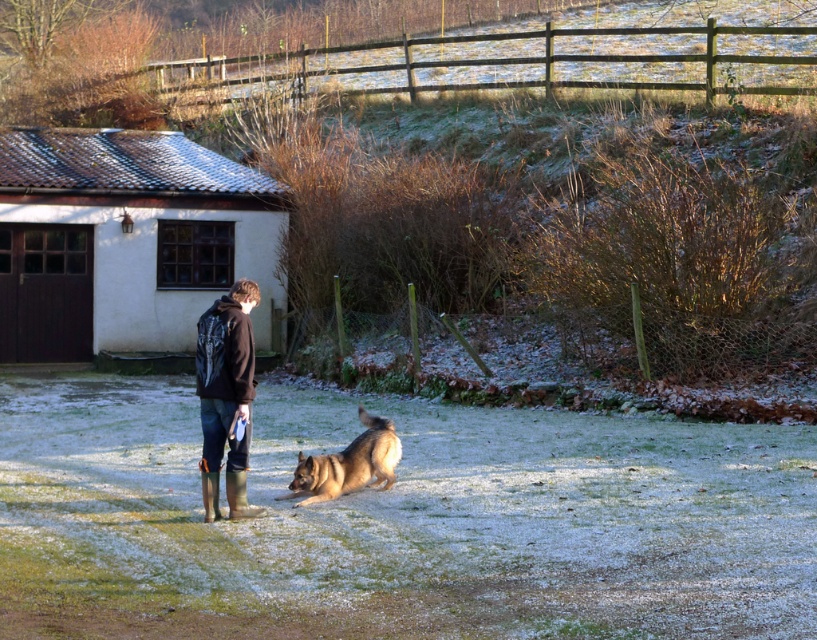
Who is more forward, [239,400] or [365,433]?

Point [239,400] is more forward.

The image size is (817, 640). Find the location of `rubber boots at center`. rubber boots at center is located at coordinates (226, 396).